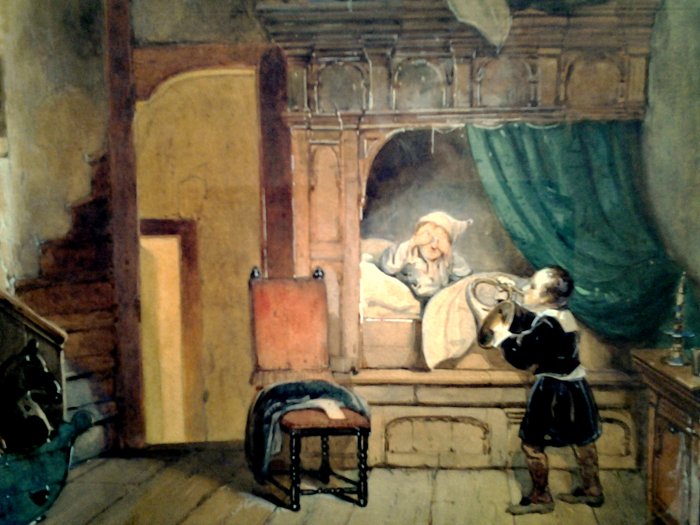
At what (x,y) coordinates should I click in order to perform the action: click on white curtain. Please return your answer as a coordinate pair (x, y). Image resolution: width=700 pixels, height=525 pixels. Looking at the image, I should click on (488, 19).